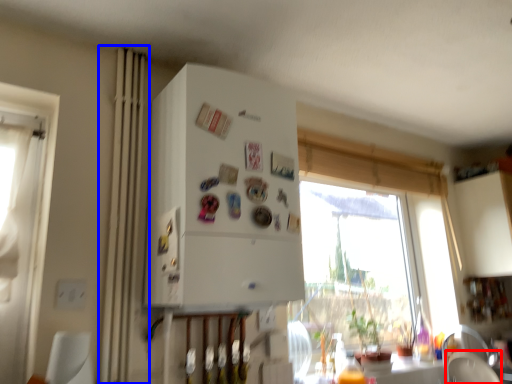
Question: Which point is further to the camera, armchair (highlighted by a red box) or curtain (highlighted by a blue box)?

Choices:
 (A) armchair
 (B) curtain

Answer: (A)